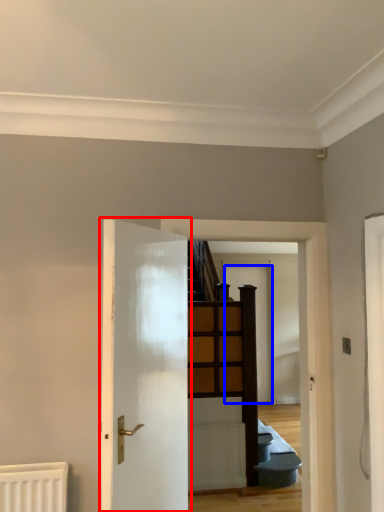
Question: Which object is further to the camera taking this photo, door (highlighted by a red box) or door (highlighted by a blue box)?

Choices:
 (A) door
 (B) door

Answer: (B)